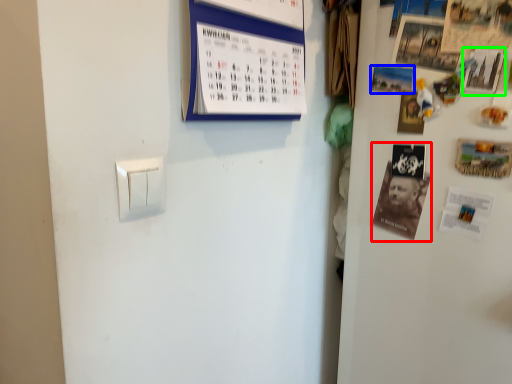
Question: Which object is the closest to the magazine (highlighted by a red box)? Choose among these: poster (highlighted by a blue box) or poster (highlighted by a green box).

Choices:
 (A) poster
 (B) poster

Answer: (A)